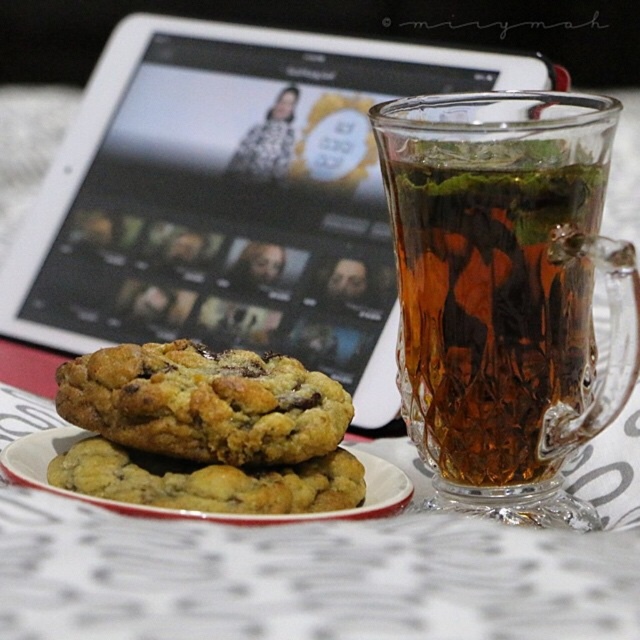
Is brown glass cup at upper right to the right of golden brown cookie with chocolate chips at center from the viewer's perspective?

Correct, you'll find brown glass cup at upper right to the right of golden brown cookie with chocolate chips at center.

This screenshot has width=640, height=640. Describe the element at coordinates (490, 298) in the screenshot. I see `brown glass cup at upper right` at that location.

Locate an element on the screen. brown glass cup at upper right is located at coordinates (490, 298).

Between point (321, 396) and point (140, 515), which one is positioned behind?

Positioned behind is point (321, 396).

Based on the photo, can you confirm if golden brown cookie with chocolate chips at center is positioned to the right of white ceramic plate at center?

Correct, you'll find golden brown cookie with chocolate chips at center to the right of white ceramic plate at center.

Between point (150, 406) and point (58, 444), which one is positioned behind?

Point (58, 444)

I want to click on golden brown cookie with chocolate chips at center, so click(204, 403).

Who is positioned more to the right, brown glass cup at upper right or white ceramic plate at center?

brown glass cup at upper right is more to the right.

This screenshot has width=640, height=640. What do you see at coordinates (490, 298) in the screenshot?
I see `brown glass cup at upper right` at bounding box center [490, 298].

Who is more forward, (556, 401) or (19, 483)?

Point (19, 483) is in front.

Locate an element on the screen. The image size is (640, 640). brown glass cup at upper right is located at coordinates (490, 298).